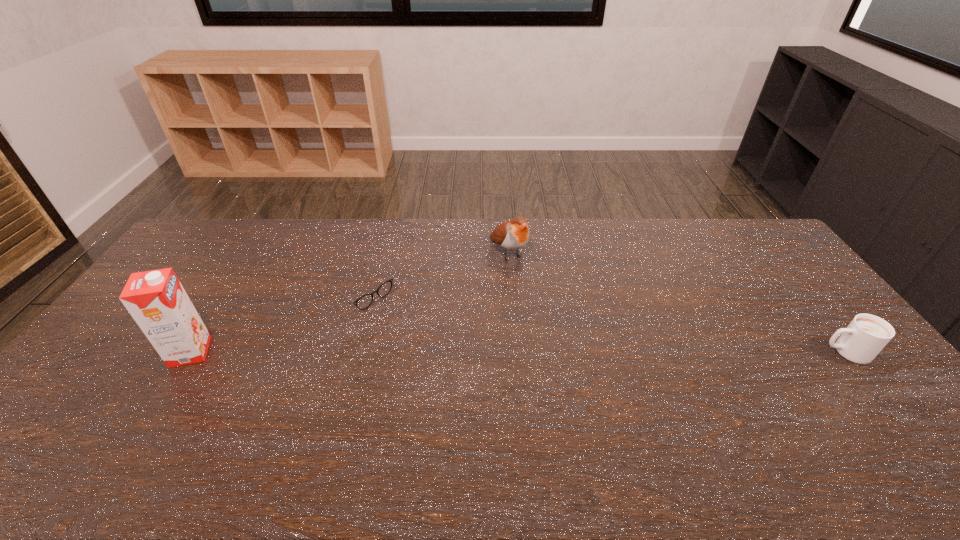
Identify the location of vacant region between the leftmost object and the cappuccino. The width and height of the screenshot is (960, 540). (518, 352).

Where is `free space between the bird and the shortest object`? The height and width of the screenshot is (540, 960). free space between the bird and the shortest object is located at coordinates (435, 272).

The image size is (960, 540). Find the location of `free space between the second object from right to left and the shortest object`. free space between the second object from right to left and the shortest object is located at coordinates (435, 272).

Where is `free spot between the shortest object and the tallest object`? This screenshot has width=960, height=540. free spot between the shortest object and the tallest object is located at coordinates (276, 321).

This screenshot has height=540, width=960. I want to click on vacant area that lies between the shortest object and the carton, so [x=276, y=321].

Select which object is the third closest to the rightmost object. Please provide its 2D coordinates. Your answer should be formatted as a tuple, i.e. [(x, y)], where the tuple contains the x and y coordinates of a point satisfying the conditions above.

[(156, 300)]

Locate which object ranks in proximity to the third object from left to right. Please provide its 2D coordinates. Your answer should be formatted as a tuple, i.e. [(x, y)], where the tuple contains the x and y coordinates of a point satisfying the conditions above.

[(365, 301)]

This screenshot has height=540, width=960. I want to click on vacant region that satisfies the following two spatial constraints: 1. on the back side of the bird; 2. on the right side of the tallest object, so click(x=252, y=253).

Locate an element on the screen. This screenshot has height=540, width=960. blank area in the image that satisfies the following two spatial constraints: 1. on the front side of the third object from left to right; 2. on the side with the handle of the cappuccino is located at coordinates (516, 352).

Find the location of `vacant area that satisfies the following two spatial constraints: 1. on the back side of the carton; 2. on the right side of the bird`. vacant area that satisfies the following two spatial constraints: 1. on the back side of the carton; 2. on the right side of the bird is located at coordinates (252, 253).